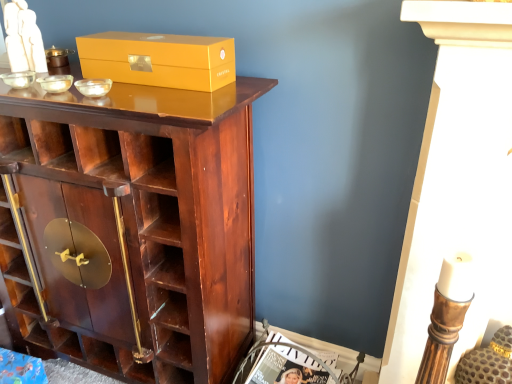
Where is `free space in front of matte gold box at upper center`? free space in front of matte gold box at upper center is located at coordinates (156, 91).